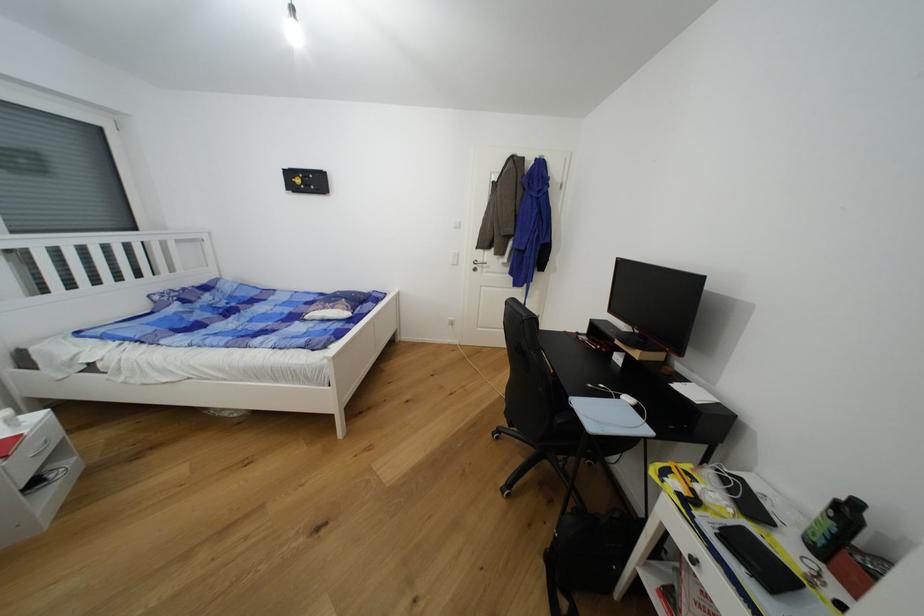
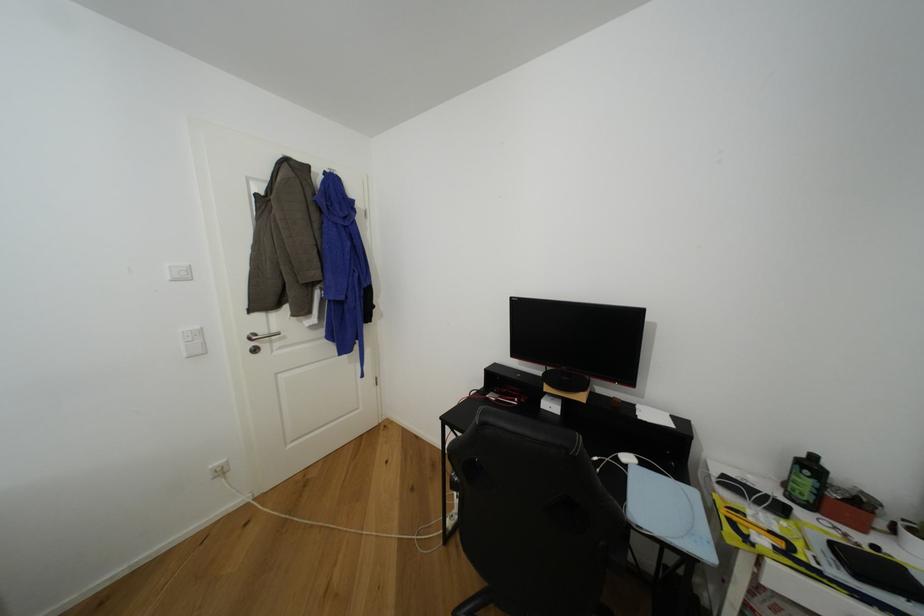
The point at (634, 400) is marked in the first image. Where is the corresponding point in the second image?

(633, 460)